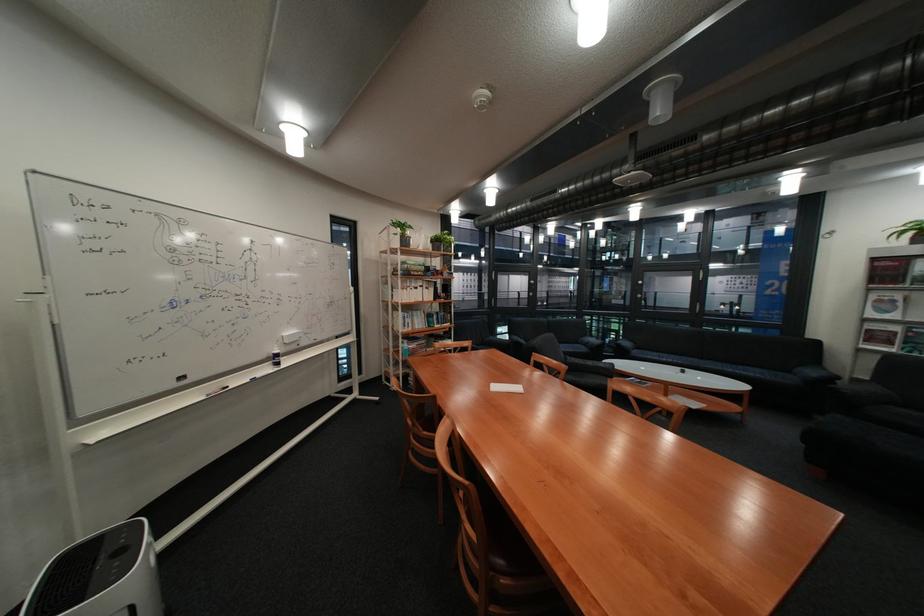
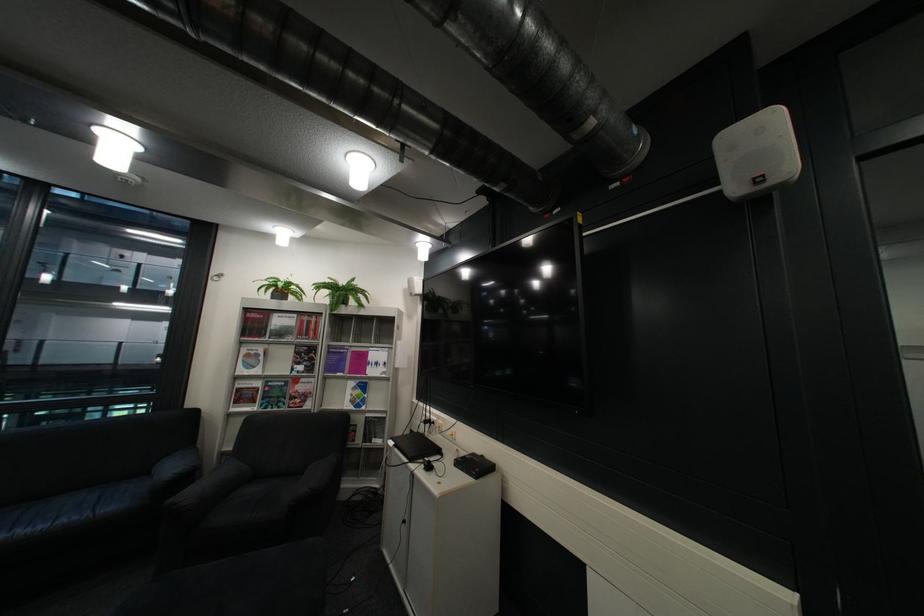
The point at (767,374) is marked in the first image. Where is the corresponding point in the second image?

(58, 527)